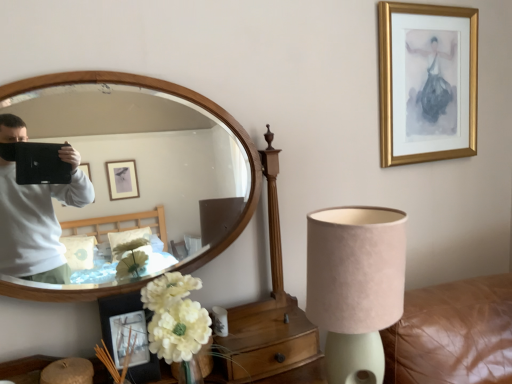
Measure the distance between point (288, 330) and camera.

Point (288, 330) and camera are 1.19 meters apart from each other.

The width and height of the screenshot is (512, 384). What do you see at coordinates (426, 82) in the screenshot? I see `gold framed picture at upper right, placed as the first picture frame when sorted from top to bottom` at bounding box center [426, 82].

Identify the location of matte black picture frame at lower left, positioned as the 1th picture frame in left-to-right order. (127, 334).

Locate an element on the screen. This screenshot has height=384, width=512. picture frame that is on the right side of white fabric flower at lower left is located at coordinates (426, 82).

In the image, is gold framed picture at upper right, which is counted as the first picture frame, starting from the right, positioned in front of or behind white fabric flower at lower left?

gold framed picture at upper right, which is counted as the first picture frame, starting from the right, is positioned farther from the viewer than white fabric flower at lower left.

Could you tell me if gold framed picture at upper right, which is the 1th picture frame from back to front, is facing white fabric flower at lower left?

No.

In terms of height, does gold framed picture at upper right, placed as the first picture frame when sorted from top to bottom, look taller or shorter compared to white fabric flower at lower left?

In the image, gold framed picture at upper right, placed as the first picture frame when sorted from top to bottom, appears to be taller than white fabric flower at lower left.

From the picture: Can you confirm if wooden drawer at lower center is smaller than gold framed picture at upper right, the second picture frame in the left-to-right sequence?

Yes.

Looking at their sizes, would you say wooden drawer at lower center is wider or thinner than gold framed picture at upper right, the 2th picture frame when ordered from bottom to top?

In the image, wooden drawer at lower center appears to be wider than gold framed picture at upper right, the 2th picture frame when ordered from bottom to top.

Does wooden drawer at lower center turn towards gold framed picture at upper right, which is counted as the 2th picture frame, starting from the front?

No, wooden drawer at lower center is not oriented towards gold framed picture at upper right, which is counted as the 2th picture frame, starting from the front.

Is point (294, 307) closer to camera compared to point (430, 142)?

Yes, point (294, 307) is in front of point (430, 142).

Does wooden mirror at left come behind suede lampshade at lower right?

Yes, the depth of wooden mirror at left is greater than that of suede lampshade at lower right.

Between wooden mirror at left and suede lampshade at lower right, which one has larger width?

suede lampshade at lower right is wider.

From a real-world perspective, relative to suede lampshade at lower right, is wooden mirror at left vertically above or below?

In terms of real-world spatial position, wooden mirror at left is above suede lampshade at lower right.

Could you tell me if wooden mirror at left is turned towards suede lampshade at lower right?

Yes, wooden mirror at left faces towards suede lampshade at lower right.

Between suede lampshade at lower right and white fabric flower at lower left, which one has more height?

suede lampshade at lower right is taller.

Is suede lampshade at lower right looking in the opposite direction of white fabric flower at lower left?

No, suede lampshade at lower right is not facing away from white fabric flower at lower left.

Does suede lampshade at lower right have a smaller size compared to white fabric flower at lower left?

Incorrect, suede lampshade at lower right is not smaller in size than white fabric flower at lower left.

Is the surface of suede lampshade at lower right in direct contact with white fabric flower at lower left?

No, suede lampshade at lower right is not next to white fabric flower at lower left.

Could you tell me if gold framed picture at upper right, which is the 1th picture frame from back to front, is turned towards suede lampshade at lower right?

No, gold framed picture at upper right, which is the 1th picture frame from back to front, is not aimed at suede lampshade at lower right.

Where is `lamp below the gold framed picture at upper right, which is the 1th picture frame from back to front (from a real-world perspective)`? Image resolution: width=512 pixels, height=384 pixels. lamp below the gold framed picture at upper right, which is the 1th picture frame from back to front (from a real-world perspective) is located at coordinates (355, 286).

Could suede lampshade at lower right be considered to be inside gold framed picture at upper right, the second picture frame in the left-to-right sequence?

No, suede lampshade at lower right is located outside of gold framed picture at upper right, the second picture frame in the left-to-right sequence.

Is gold framed picture at upper right, the 2th picture frame when ordered from bottom to top, with suede lampshade at lower right?

There is a gap between gold framed picture at upper right, the 2th picture frame when ordered from bottom to top, and suede lampshade at lower right.

What are the coordinates of `picture frame on the right of wooden mirror at left` in the screenshot? It's located at (426, 82).

From the picture: Is gold framed picture at upper right, which is the 1th picture frame from back to front, oriented away from wooden mirror at left?

No.

Considering the positions of objects gold framed picture at upper right, which is counted as the first picture frame, starting from the right, and wooden mirror at left in the image provided, who is more to the right, gold framed picture at upper right, which is counted as the first picture frame, starting from the right, or wooden mirror at left?

gold framed picture at upper right, which is counted as the first picture frame, starting from the right, is more to the right.

Considering the sizes of matte black picture frame at lower left, positioned as the 1th picture frame in left-to-right order, and wooden drawer at lower center in the image, is matte black picture frame at lower left, positioned as the 1th picture frame in left-to-right order, taller or shorter than wooden drawer at lower center?

matte black picture frame at lower left, positioned as the 1th picture frame in left-to-right order, is taller than wooden drawer at lower center.

Is matte black picture frame at lower left, positioned as the 1th picture frame in left-to-right order, facing away from wooden drawer at lower center?

matte black picture frame at lower left, positioned as the 1th picture frame in left-to-right order, is not turned away from wooden drawer at lower center.

Considering the sizes of objects matte black picture frame at lower left, positioned as the 1th picture frame in left-to-right order, and wooden drawer at lower center in the image provided, who is smaller, matte black picture frame at lower left, positioned as the 1th picture frame in left-to-right order, or wooden drawer at lower center?

Smaller between the two is matte black picture frame at lower left, positioned as the 1th picture frame in left-to-right order.

Is matte black picture frame at lower left, positioned as the 1th picture frame in front-to-back order, beside wooden drawer at lower center?

No, matte black picture frame at lower left, positioned as the 1th picture frame in front-to-back order, is not next to wooden drawer at lower center.

Starting from the white fabric flower at lower left, which picture frame is the 2nd one behind? Please provide its 2D coordinates.

[(426, 82)]

The width and height of the screenshot is (512, 384). Find the location of `dresser to the left of gold framed picture at upper right, the 2th picture frame when ordered from bottom to top`. dresser to the left of gold framed picture at upper right, the 2th picture frame when ordered from bottom to top is located at coordinates (264, 340).

When comparing their distances from suede lampshade at lower right, does wooden mirror at left or matte black picture frame at lower left, arranged as the 2th picture frame when viewed from the right, seem closer?

Based on the image, matte black picture frame at lower left, arranged as the 2th picture frame when viewed from the right, appears to be nearer to suede lampshade at lower right.

Looking at this image, estimate the real-world distances between objects in this image. Which object is further from matte black picture frame at lower left, positioned as the 1th picture frame in left-to-right order, wooden mirror at left or white fabric flower at lower left?

white fabric flower at lower left.

From the image, which object appears to be farther from suede lampshade at lower right, gold framed picture at upper right, the 2th picture frame when ordered from bottom to top, or matte black picture frame at lower left, arranged as the 2th picture frame when viewed from the right?

Among the two, gold framed picture at upper right, the 2th picture frame when ordered from bottom to top, is located further to suede lampshade at lower right.

Looking at the image, which one is located further to white fabric flower at lower left, suede lampshade at lower right or wooden drawer at lower center?

Among the two, suede lampshade at lower right is located further to white fabric flower at lower left.

Estimate the real-world distances between objects in this image. Which object is closer to wooden drawer at lower center, wooden mirror at left or suede lampshade at lower right?

suede lampshade at lower right is closer to wooden drawer at lower center.

Considering their positions, is wooden mirror at left positioned further to wooden drawer at lower center than gold framed picture at upper right, the 2th picture frame when ordered from bottom to top?

gold framed picture at upper right, the 2th picture frame when ordered from bottom to top, is further to wooden drawer at lower center.

Considering their positions, is wooden drawer at lower center positioned further to suede lampshade at lower right than matte black picture frame at lower left, arranged as the 2th picture frame when viewed from the right?

matte black picture frame at lower left, arranged as the 2th picture frame when viewed from the right, is further to suede lampshade at lower right.

From the image, which object appears to be farther from gold framed picture at upper right, the 2th picture frame when ordered from bottom to top, suede lampshade at lower right or matte black picture frame at lower left, marked as the 1th picture frame in a bottom-to-top arrangement?

matte black picture frame at lower left, marked as the 1th picture frame in a bottom-to-top arrangement, lies further to gold framed picture at upper right, the 2th picture frame when ordered from bottom to top, than the other object.

This screenshot has height=384, width=512. I want to click on lamp between gold framed picture at upper right, which is counted as the 2th picture frame, starting from the front, and wooden drawer at lower center vertically, so click(x=355, y=286).

Image resolution: width=512 pixels, height=384 pixels. Identify the location of flower between matte black picture frame at lower left, positioned as the 1th picture frame in front-to-back order, and gold framed picture at upper right, which is counted as the first picture frame, starting from the right, in the horizontal direction. (175, 317).

Find the location of a particular element. flower between wooden mirror at left and gold framed picture at upper right, which is counted as the 2th picture frame, starting from the front, in the horizontal direction is located at coordinates (175, 317).

This screenshot has width=512, height=384. In order to click on flower located between matte black picture frame at lower left, marked as the 1th picture frame in a bottom-to-top arrangement, and suede lampshade at lower right in the left-right direction in this screenshot , I will do `click(175, 317)`.